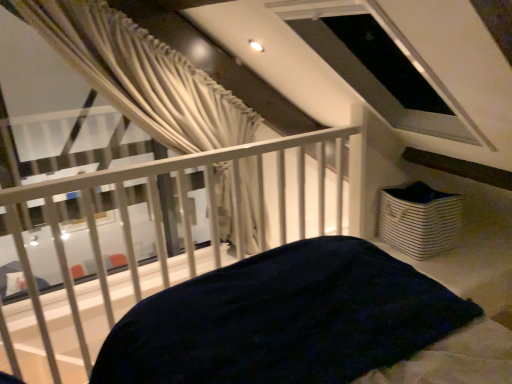
Question: Should I look upward or downward to see white striped fabric basket at lower right?

Choices:
 (A) down
 (B) up

Answer: (A)

Question: Considering the relative sizes of white striped fabric basket at lower right and white metal railing at upper center in the image provided, is white striped fabric basket at lower right bigger than white metal railing at upper center?

Choices:
 (A) no
 (B) yes

Answer: (A)

Question: Is white striped fabric basket at lower right facing away from white metal railing at upper center?

Choices:
 (A) no
 (B) yes

Answer: (A)

Question: From a real-world perspective, is white striped fabric basket at lower right beneath white metal railing at upper center?

Choices:
 (A) yes
 (B) no

Answer: (A)

Question: Is white striped fabric basket at lower right to the right of white metal railing at upper center from the viewer's perspective?

Choices:
 (A) no
 (B) yes

Answer: (B)

Question: Does white striped fabric basket at lower right turn towards white metal railing at upper center?

Choices:
 (A) no
 (B) yes

Answer: (B)

Question: Are white striped fabric basket at lower right and white metal railing at upper center located far from each other?

Choices:
 (A) yes
 (B) no

Answer: (B)

Question: Would you say white metal railing at upper center contains white striped fabric basket at lower right?

Choices:
 (A) no
 (B) yes

Answer: (A)

Question: Is white metal railing at upper center thinner than white striped fabric basket at lower right?

Choices:
 (A) no
 (B) yes

Answer: (A)

Question: From the image's perspective, would you say white metal railing at upper center is shown under white striped fabric basket at lower right?

Choices:
 (A) no
 (B) yes

Answer: (B)

Question: Is there a large distance between white metal railing at upper center and white striped fabric basket at lower right?

Choices:
 (A) yes
 (B) no

Answer: (B)

Question: Is white metal railing at upper center bigger than white striped fabric basket at lower right?

Choices:
 (A) yes
 (B) no

Answer: (A)

Question: Is white metal railing at upper center in front of white striped fabric basket at lower right?

Choices:
 (A) yes
 (B) no

Answer: (A)

Question: Looking at the image, does white metal railing at upper center seem bigger or smaller compared to white striped fabric basket at lower right?

Choices:
 (A) big
 (B) small

Answer: (A)